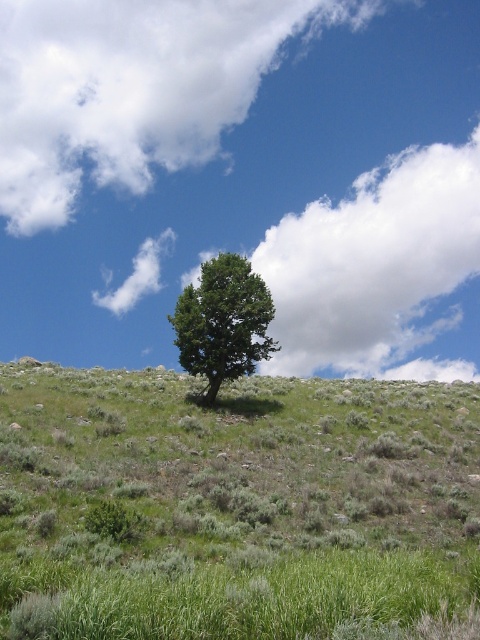
Question: Is green grassy hillside at center further to the viewer compared to green leafy tree at center?

Choices:
 (A) yes
 (B) no

Answer: (B)

Question: Which is nearer to the green grassy hillside at center?

Choices:
 (A) white fluffy cloud at upper center
 (B) green leafy tree at center

Answer: (B)

Question: Can you confirm if green grassy hillside at center is wider than green leafy tree at center?

Choices:
 (A) yes
 (B) no

Answer: (A)

Question: Which of the following is the closest to the observer?

Choices:
 (A) green grassy hillside at center
 (B) green leafy tree at center
 (C) white fluffy cloud at upper center

Answer: (A)

Question: Does green grassy hillside at center appear under white fluffy cloud at upper center?

Choices:
 (A) yes
 (B) no

Answer: (A)

Question: Which of the following is the farthest from the observer?

Choices:
 (A) coord(182,321)
 (B) coord(83,108)
 (C) coord(362,614)

Answer: (B)